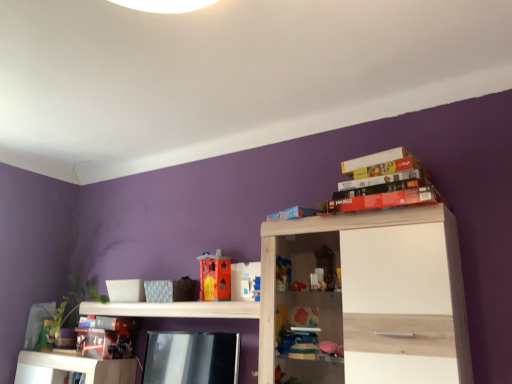
Question: Looking at the image, does white plastic toy at center, positioned as the first toy in front-to-back order, seem bigger or smaller compared to translucent plastic toy at lower left, the first toy when ordered from bottom to top?

Choices:
 (A) small
 (B) big

Answer: (A)

Question: In terms of width, does white plastic toy at center, arranged as the 2th toy when viewed from the top, look wider or thinner when compared to translucent plastic toy at lower left, the 3th toy when ordered from right to left?

Choices:
 (A) wide
 (B) thin

Answer: (B)

Question: Estimate the real-world distances between objects in this image. Which object is farther from the white plastic toy at center, which appears as the 2th toy when ordered from the bottom?

Choices:
 (A) matte cardboard book at upper right, which ranks as the fifth book in bottom-to-top order
 (B) matte cardboard book at upper right, the second book from the top
 (C) metallic silver book at center, which ranks as the 1th book in bottom-to-top order
 (D) matte red lego box at upper right, which is the third book in bottom-to-top order
 (E) white wood cabinet at upper right, the 1th shelf when ordered from right to left

Answer: (A)

Question: Which of these objects is positioned closest to the matte cardboard book at upper right, positioned as the 4th book in bottom-to-top order?

Choices:
 (A) blue matte bookshelf at upper center, which appears as the 2th book when ordered from the bottom
 (B) matte cardboard book at upper right, which is the 1th book from top to bottom
 (C) matte red lego box at upper right, the 3th book from the top
 (D) translucent plastic toy at lower left, which is counted as the first toy, starting from the left
 (E) white wood shelf at center, positioned as the second shelf in right-to-left order

Answer: (C)